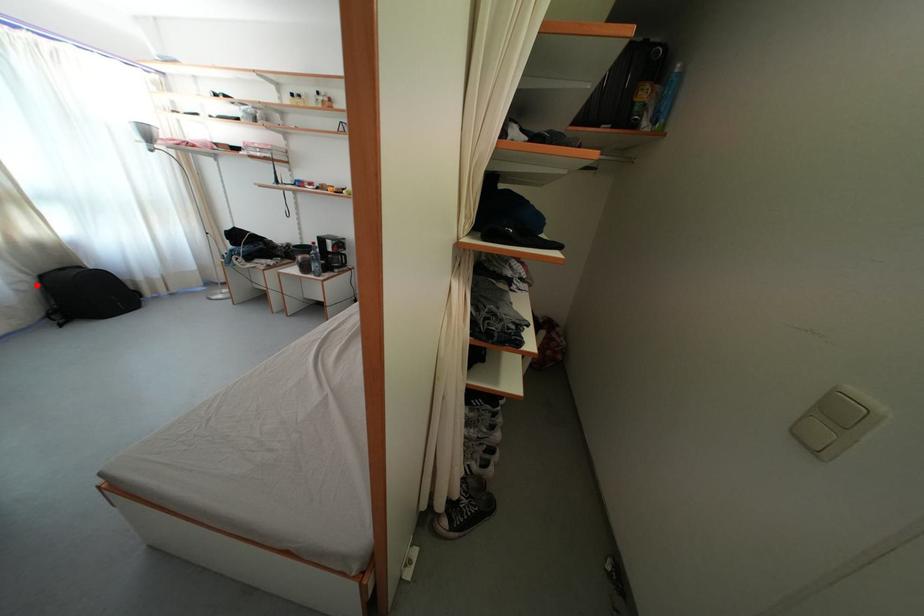
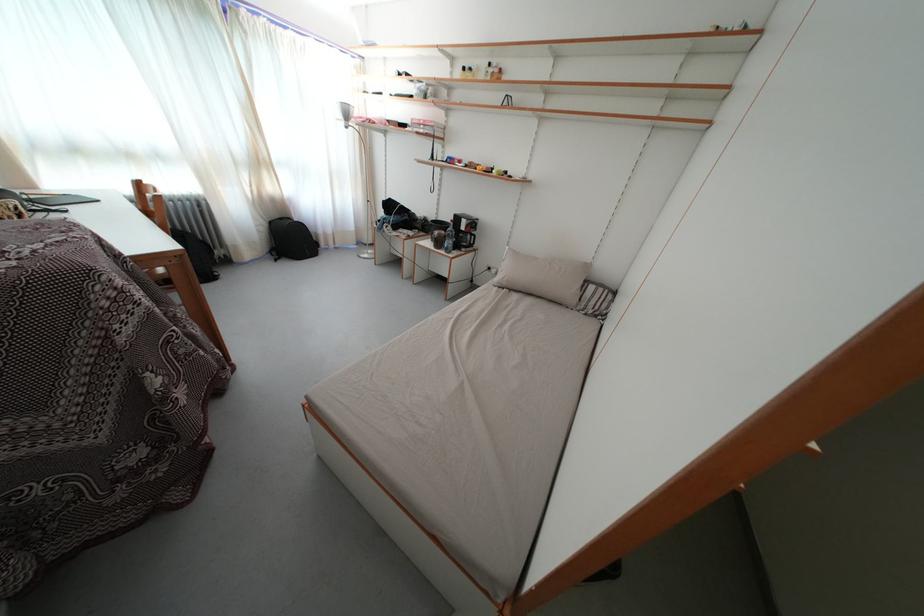
The point at the highlighted location is marked in the first image. Where is the corresponding point in the second image?

(272, 230)